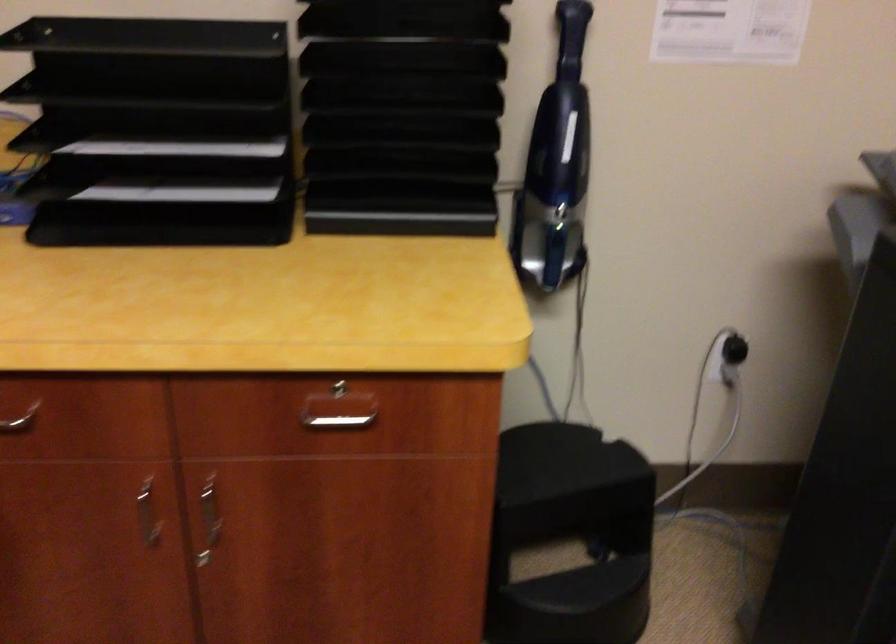
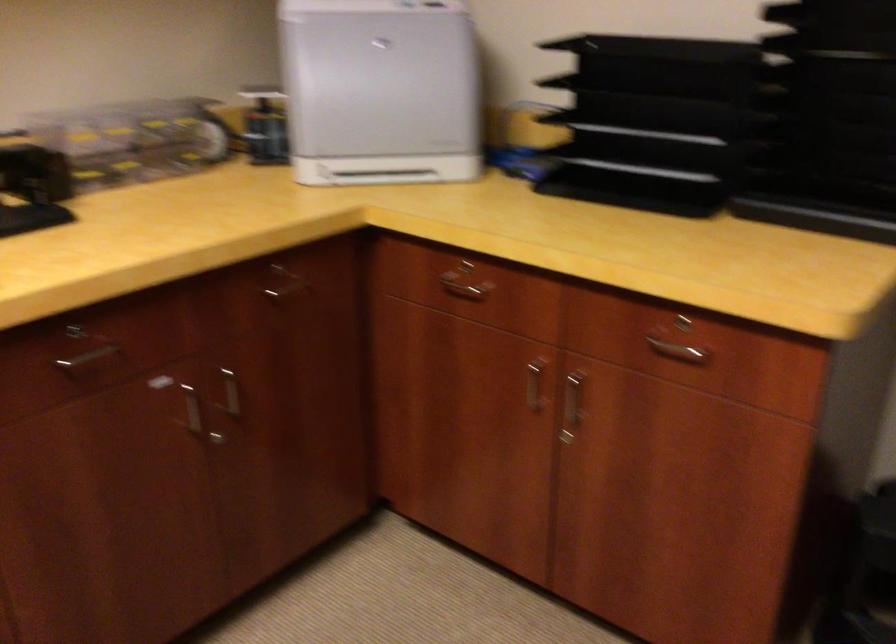
Question: The first image is from the beginning of the video and the second image is from the end. How did the camera likely rotate when shooting the video?

Choices:
 (A) Left
 (B) Right
 (C) Up
 (D) Down

Answer: (A)